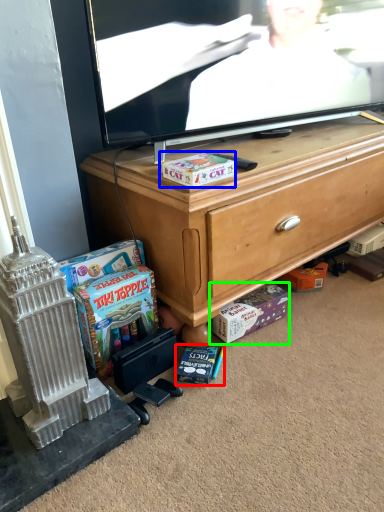
Question: Which is nearer to the book (highlighted by a red box)? cash (highlighted by a blue box) or cash (highlighted by a green box).

Choices:
 (A) cash
 (B) cash

Answer: (B)